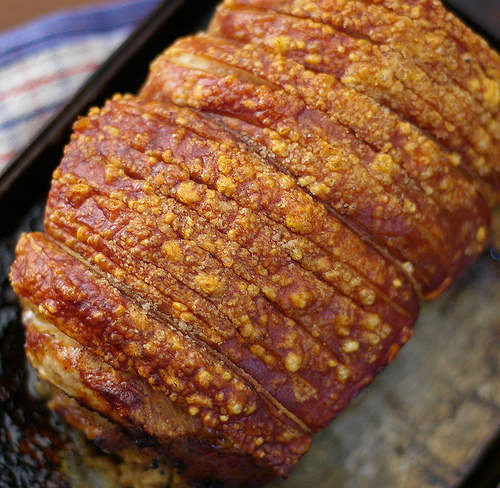
Identify the location of floor. (32, 5).